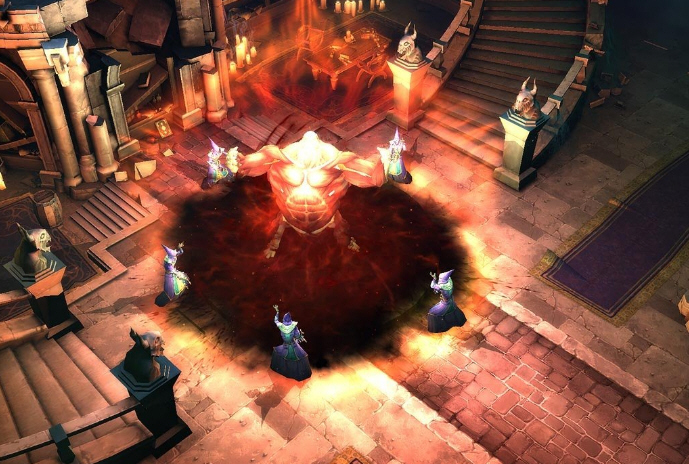
Locate an element on the screen. This screenshot has height=464, width=689. table is located at coordinates (355, 52).